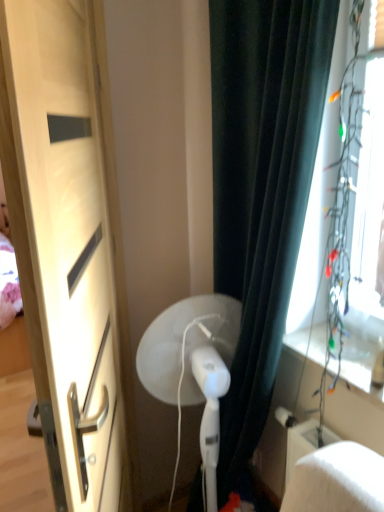
The image size is (384, 512). I want to click on matte wood door at left, so click(x=67, y=245).

What is the approximate width of dark green fabric curtain at right?

dark green fabric curtain at right is 8.62 inches in width.

Where is `white plastic fan at center`? The height and width of the screenshot is (512, 384). white plastic fan at center is located at coordinates (181, 340).

From a real-world perspective, is white plastic fan at center under dark green fabric curtain at right?

Yes, from a real-world perspective, white plastic fan at center is below dark green fabric curtain at right.

Is white plastic fan at center further to the viewer compared to dark green fabric curtain at right?

Yes, white plastic fan at center is further from the camera.

Measure the distance between white plastic fan at center and dark green fabric curtain at right.

white plastic fan at center is 11.34 inches away from dark green fabric curtain at right.

Are white plastic fan at center and dark green fabric curtain at right beside each other?

No, white plastic fan at center is not with dark green fabric curtain at right.

Does transparent plastic window screen at right have a lesser height compared to dark green fabric curtain at right?

Yes.

Is transparent plastic window screen at right beside dark green fabric curtain at right?

No, transparent plastic window screen at right is not touching dark green fabric curtain at right.

Based on the photo, looking at the image, does transparent plastic window screen at right seem bigger or smaller compared to dark green fabric curtain at right?

transparent plastic window screen at right is smaller than dark green fabric curtain at right.

From the image's perspective, is transparent plastic window screen at right above or below dark green fabric curtain at right?

From the image's perspective, transparent plastic window screen at right appears above dark green fabric curtain at right.

The image size is (384, 512). What are the coordinates of `fan that is under the dark green fabric curtain at right (from a real-world perspective)` in the screenshot? It's located at (181, 340).

From the image's perspective, is dark green fabric curtain at right below white plastic fan at center?

Actually, dark green fabric curtain at right appears above white plastic fan at center in the image.

In the scene shown: Is dark green fabric curtain at right far from white plastic fan at center?

No.

What's the angular difference between dark green fabric curtain at right and white plastic fan at center's facing directions?

108 degrees separate the facing orientations of dark green fabric curtain at right and white plastic fan at center.

Is matte wood door at left positioned behind white plastic fan at center?

No, the depth of matte wood door at left is less than that of white plastic fan at center.

Is matte wood door at left facing towards white plastic fan at center?

Yes, matte wood door at left faces towards white plastic fan at center.

Is point (12, 70) positioned behind point (229, 321)?

No, (12, 70) is closer to viewer.

At what (x,y) coordinates should I click in order to perform the action: click on door above the white plastic fan at center (from the image's perspective). Please return your answer as a coordinate pair (x, y). The height and width of the screenshot is (512, 384). Looking at the image, I should click on (67, 245).

Do you think dark green fabric curtain at right is within transparent plastic window screen at right, or outside of it?

dark green fabric curtain at right exists outside the volume of transparent plastic window screen at right.

What's the angular difference between dark green fabric curtain at right and transparent plastic window screen at right's facing directions?

The facing directions of dark green fabric curtain at right and transparent plastic window screen at right are 0.00348 degrees apart.

Does point (313, 73) lie behind point (324, 334)?

No, it is not.

Could you measure the distance between dark green fabric curtain at right and transparent plastic window screen at right?

dark green fabric curtain at right is 8.73 inches from transparent plastic window screen at right.

Could you tell me if white plastic fan at center is turned towards transparent plastic window screen at right?

No, white plastic fan at center is not aimed at transparent plastic window screen at right.

Considering their positions, is white plastic fan at center located in front of or behind transparent plastic window screen at right?

Clearly, white plastic fan at center is behind transparent plastic window screen at right.

Find the location of `window screen above the white plastic fan at center (from the image's perspective)`. window screen above the white plastic fan at center (from the image's perspective) is located at coordinates (335, 180).

Between matte wood door at left and dark green fabric curtain at right, which one is positioned in front?

matte wood door at left is more forward.

Consider the image. Between matte wood door at left and dark green fabric curtain at right, which one has smaller width?

Thinner between the two is matte wood door at left.

Is matte wood door at left not close to dark green fabric curtain at right?

No, matte wood door at left is in close proximity to dark green fabric curtain at right.

From the picture: Which object is positioned more to the left, matte wood door at left or dark green fabric curtain at right?

matte wood door at left.

The height and width of the screenshot is (512, 384). In order to click on fan behind the dark green fabric curtain at right in this screenshot , I will do `click(181, 340)`.

This screenshot has height=512, width=384. In order to click on window screen on the right of dark green fabric curtain at right in this screenshot , I will do coord(335,180).

Based on their spatial positions, is white plastic fan at center or dark green fabric curtain at right further from matte wood door at left?

dark green fabric curtain at right.

When comparing their distances from transparent plastic window screen at right, does white plastic fan at center or matte wood door at left seem further?

matte wood door at left lies further to transparent plastic window screen at right than the other object.

When comparing their distances from white plastic fan at center, does dark green fabric curtain at right or transparent plastic window screen at right seem closer?

Among the two, dark green fabric curtain at right is located nearer to white plastic fan at center.

From the image, which object appears to be farther from matte wood door at left, white plastic fan at center or transparent plastic window screen at right?

transparent plastic window screen at right.

Estimate the real-world distances between objects in this image. Which object is further from white plastic fan at center, matte wood door at left or transparent plastic window screen at right?

The object further to white plastic fan at center is transparent plastic window screen at right.

Estimate the real-world distances between objects in this image. Which object is further from white plastic fan at center, transparent plastic window screen at right or dark green fabric curtain at right?

transparent plastic window screen at right is positioned further to the anchor white plastic fan at center.

When comparing their distances from dark green fabric curtain at right, does transparent plastic window screen at right or white plastic fan at center seem further?

The object further to dark green fabric curtain at right is white plastic fan at center.

Based on their spatial positions, is white plastic fan at center or dark green fabric curtain at right further from transparent plastic window screen at right?

white plastic fan at center.

At what (x,y) coordinates should I click in order to perform the action: click on window screen located between matte wood door at left and white plastic fan at center in the depth direction. Please return your answer as a coordinate pair (x, y). This screenshot has width=384, height=512. Looking at the image, I should click on (335, 180).

I want to click on curtain between matte wood door at left and white plastic fan at center along the z-axis, so click(x=262, y=187).

This screenshot has height=512, width=384. In order to click on curtain between transparent plastic window screen at right and white plastic fan at center vertically in this screenshot , I will do `click(262, 187)`.

Image resolution: width=384 pixels, height=512 pixels. I want to click on curtain located between matte wood door at left and transparent plastic window screen at right in the left-right direction, so click(262, 187).